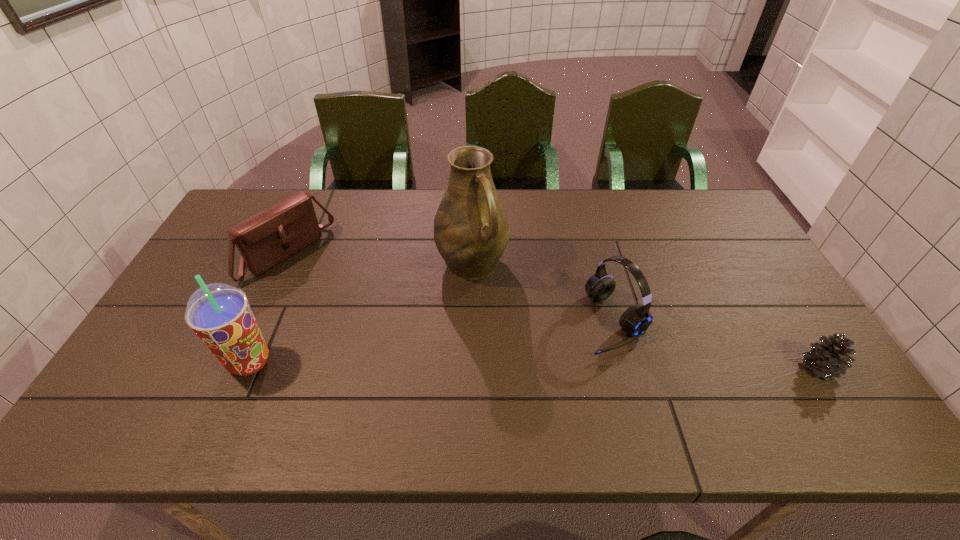
You are a GUI agent. You are given a task and a screenshot of the screen. Output one action in this format:
    pyautogui.click(x=<x>, y=<y>)
    Task: Click on the pinecone that is at the near edge
    Image resolution: width=960 pixels, height=540 pixels.
    Given the screenshot: What is the action you would take?
    pyautogui.click(x=830, y=359)

Find the location of a particular element. This screenshot has height=540, width=960. object that is at the left edge is located at coordinates (267, 238).

This screenshot has height=540, width=960. What are the coordinates of `object at the right edge` in the screenshot? It's located at (830, 359).

Where is `object at the far left corner`? object at the far left corner is located at coordinates (267, 238).

Locate an element on the screen. object that is at the near right corner is located at coordinates (830, 359).

Image resolution: width=960 pixels, height=540 pixels. In the image, there is a desktop. Find the location of `vacant space at the far edge`. vacant space at the far edge is located at coordinates (395, 212).

In the image, there is a desktop. Where is `vacant area at the near edge`? The width and height of the screenshot is (960, 540). vacant area at the near edge is located at coordinates (619, 371).

Where is `vacant space at the right edge`? vacant space at the right edge is located at coordinates (703, 240).

Identify the location of free space between the smoothie and the shortest object. The image size is (960, 540). (535, 365).

I want to click on free space between the shoulder bag and the fourth shortest object, so click(x=269, y=308).